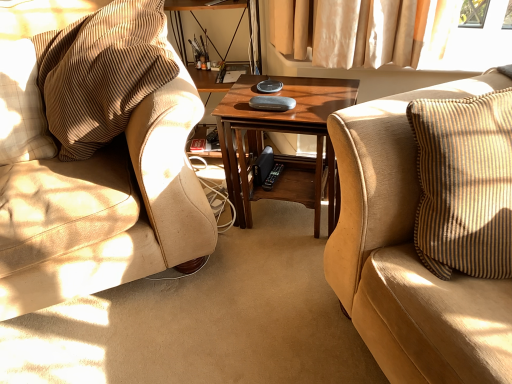
Locate an element on the screen. vacant point above wooden coffee table at center (from a real-world perspective) is located at coordinates (293, 95).